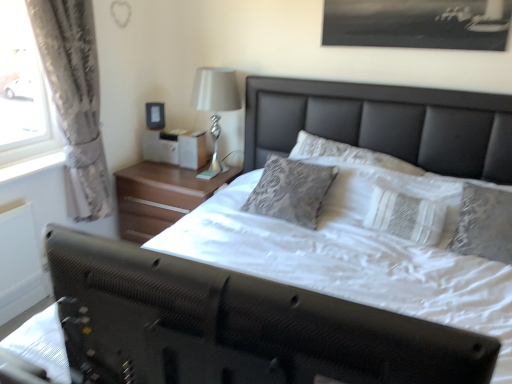
Question: Is white glossy lamp at upper right closer to the viewer compared to wooden nightstand at center?

Choices:
 (A) no
 (B) yes

Answer: (B)

Question: Can you confirm if white glossy lamp at upper right is smaller than wooden nightstand at center?

Choices:
 (A) no
 (B) yes

Answer: (B)

Question: Can you confirm if white glossy lamp at upper right is taller than wooden nightstand at center?

Choices:
 (A) no
 (B) yes

Answer: (B)

Question: From a real-world perspective, is white glossy lamp at upper right on wooden nightstand at center?

Choices:
 (A) no
 (B) yes

Answer: (B)

Question: Is white glossy lamp at upper right oriented towards wooden nightstand at center?

Choices:
 (A) no
 (B) yes

Answer: (A)

Question: Considering the positions of matte black picture frame at upper center and white glossy lamp at upper right in the image, is matte black picture frame at upper center wider or thinner than white glossy lamp at upper right?

Choices:
 (A) wide
 (B) thin

Answer: (B)

Question: From a real-world perspective, relative to white glossy lamp at upper right, is matte black picture frame at upper center vertically above or below?

Choices:
 (A) below
 (B) above

Answer: (A)

Question: Choose the correct answer: Is matte black picture frame at upper center inside white glossy lamp at upper right or outside it?

Choices:
 (A) outside
 (B) inside

Answer: (A)

Question: Is matte black picture frame at upper center in front of or behind white glossy lamp at upper right in the image?

Choices:
 (A) front
 (B) behind

Answer: (B)

Question: From a real-world perspective, relative to white glossy lamp at upper right, is white fabric bed at center vertically above or below?

Choices:
 (A) above
 (B) below

Answer: (B)

Question: Would you say white fabric bed at center is to the left or to the right of white glossy lamp at upper right in the picture?

Choices:
 (A) right
 (B) left

Answer: (A)

Question: Is white fabric bed at center in front of or behind white glossy lamp at upper right in the image?

Choices:
 (A) behind
 (B) front

Answer: (B)

Question: Is point (385, 327) closer or farther from the camera than point (212, 114)?

Choices:
 (A) farther
 (B) closer

Answer: (B)

Question: From a real-world perspective, is matte black picture frame at upper center positioned above or below white fabric bed at center?

Choices:
 (A) above
 (B) below

Answer: (A)

Question: From their relative heights in the image, would you say matte black picture frame at upper center is taller or shorter than white fabric bed at center?

Choices:
 (A) tall
 (B) short

Answer: (B)